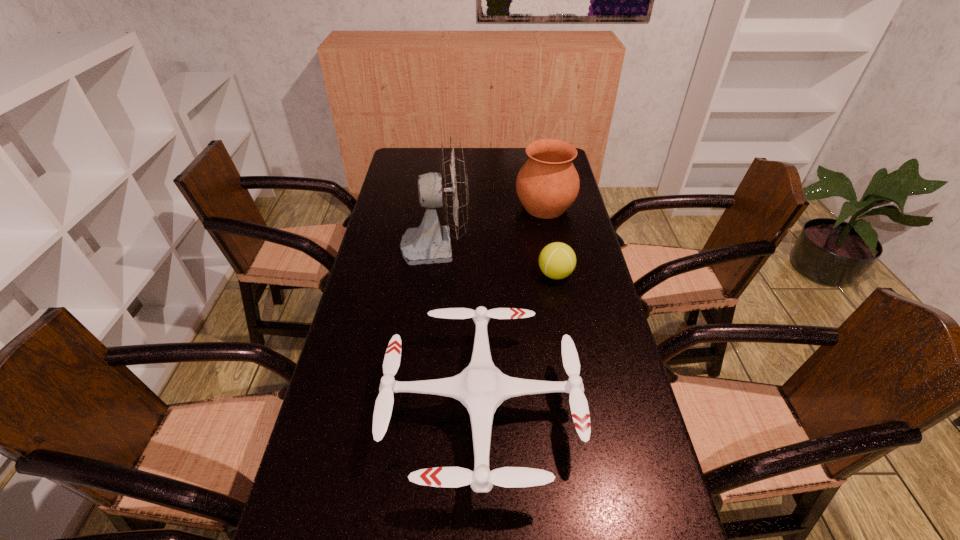
Find the location of a particular element. the tallest object is located at coordinates (430, 243).

Where is `the second tallest object`? This screenshot has height=540, width=960. the second tallest object is located at coordinates (547, 184).

The height and width of the screenshot is (540, 960). What are the coordinates of `the nearest object` in the screenshot? It's located at (481, 387).

Image resolution: width=960 pixels, height=540 pixels. Find the location of `tennis ball`. tennis ball is located at coordinates (557, 260).

Where is `vacant space located in front of the fan to blow air`? This screenshot has height=540, width=960. vacant space located in front of the fan to blow air is located at coordinates (557, 245).

Find the location of a particular element. vacant space located 0.280m on the front of the pottery is located at coordinates (559, 279).

The width and height of the screenshot is (960, 540). In order to click on blank area located with the camera attached at the bottom of the drone in this screenshot , I will do `click(351, 408)`.

Where is `vacant space situated 0.080m with the camera attached at the bottom of the drone`? vacant space situated 0.080m with the camera attached at the bottom of the drone is located at coordinates (351, 408).

Find the location of a particular element. vacant space located 0.050m with the camera attached at the bottom of the drone is located at coordinates (364, 408).

Image resolution: width=960 pixels, height=540 pixels. In order to click on blank space located on the back of the tennis ball in this screenshot , I will do `click(543, 211)`.